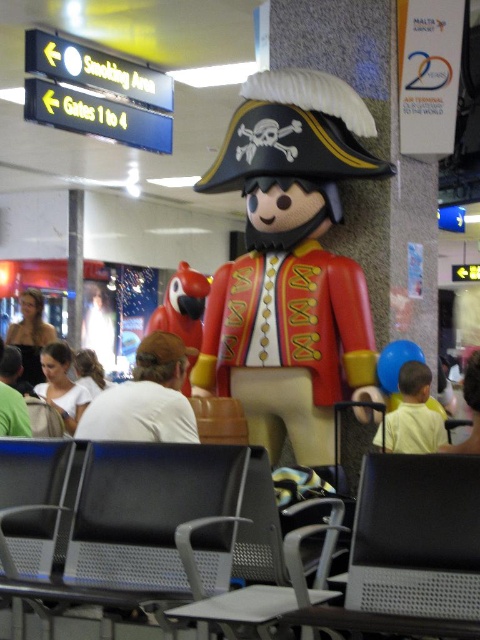
You are standing at the airport terminal and see two points marked on the floor. The first point is at position point (10, 532) and the second is at point (427, 420). If you want to walk from the first point to the second point, which direction should you move relative to the airport terminal layout?

You should move towards the back of the airport terminal because point (10, 532) is in front of point (427, 420), meaning the second point is located behind the first one.

You are a traveler sitting at the airport and see the white cotton shirt at lower left and the matte red parrot at center. Which object is positioned to the left of the other?

The white cotton shirt at lower left is to the right of the matte red parrot at center, so the matte red parrot at center is positioned to the left of the white cotton shirt at lower left.

You are a passenger who just arrived at the airport terminal. You see a black metal chair at lower left and a light yellow shirt at center. Which object is larger in size?

The black metal chair at lower left is bigger than the light yellow shirt at center.